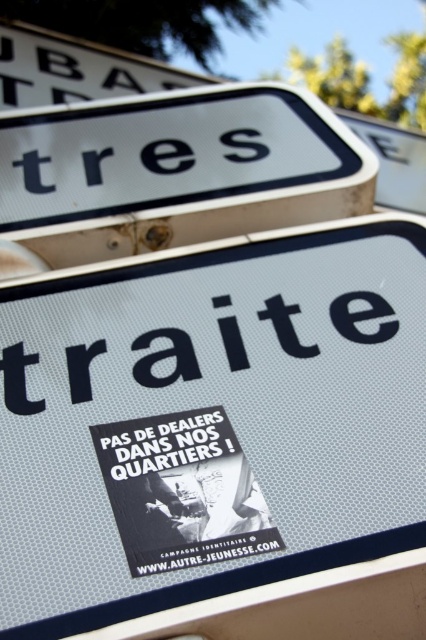
Can you confirm if black plastic text at center is positioned above black paper sticker at center?

Yes.

The image size is (426, 640). What do you see at coordinates (166, 356) in the screenshot?
I see `black plastic text at center` at bounding box center [166, 356].

Find the location of a particular element. The height and width of the screenshot is (640, 426). black plastic text at center is located at coordinates (166, 356).

Looking at this image, is white textured sign at center below black plastic text at center?

Yes.

Does point (238, 451) lie in front of point (356, 337)?

That is True.

In the scene shown: Who is more forward, (357, 220) or (77, 378)?

Point (77, 378)

I want to click on white textured sign at center, so click(218, 436).

Between black paper sticker at center and black matte text at center, which one is positioned lower?

black matte text at center

Can you confirm if black paper sticker at center is thinner than black matte text at center?

No.

You are a GUI agent. You are given a task and a screenshot of the screen. Output one action in this format:
    pyautogui.click(x=<x>, y=<y>)
    Task: Click on the black paper sticker at center
    
    Given the screenshot: What is the action you would take?
    pyautogui.click(x=163, y=442)

Locate an element on the screen. black paper sticker at center is located at coordinates (163, 442).